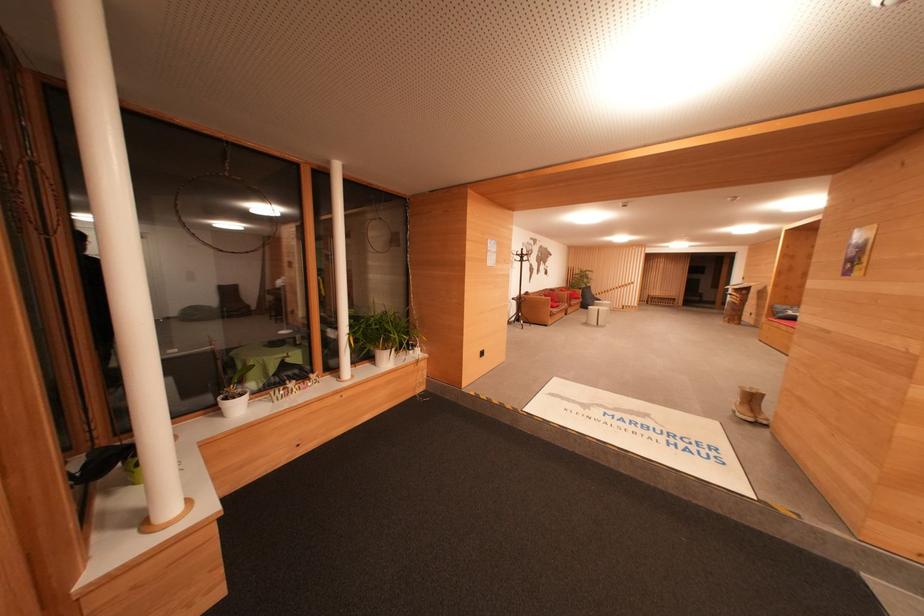
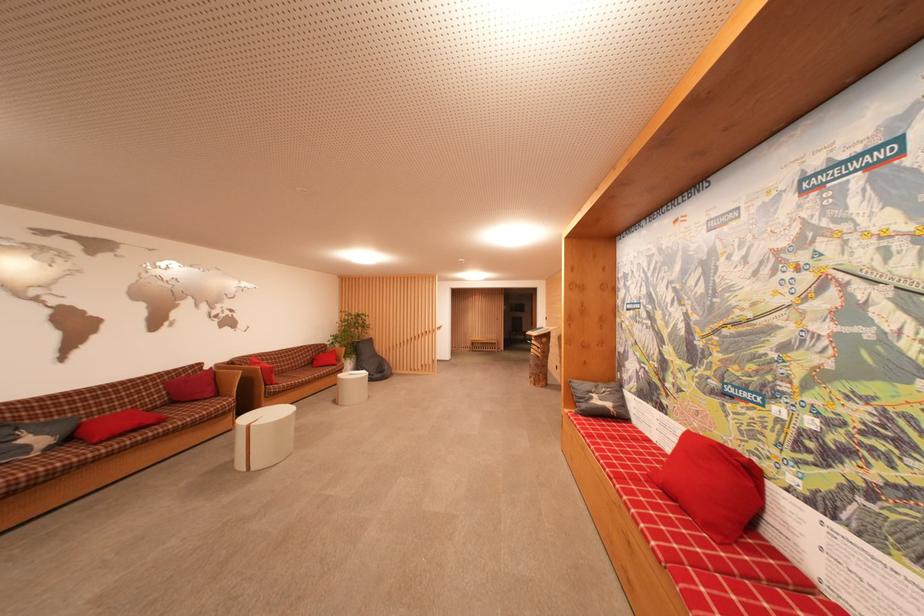
Locate, in the second image, the point that corresponds to (795,315) in the first image.

(601, 405)